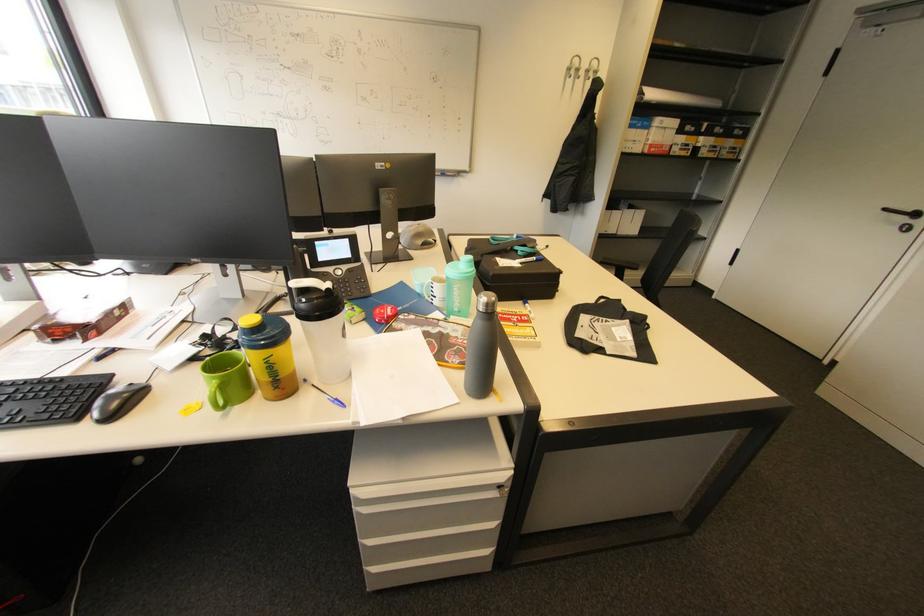
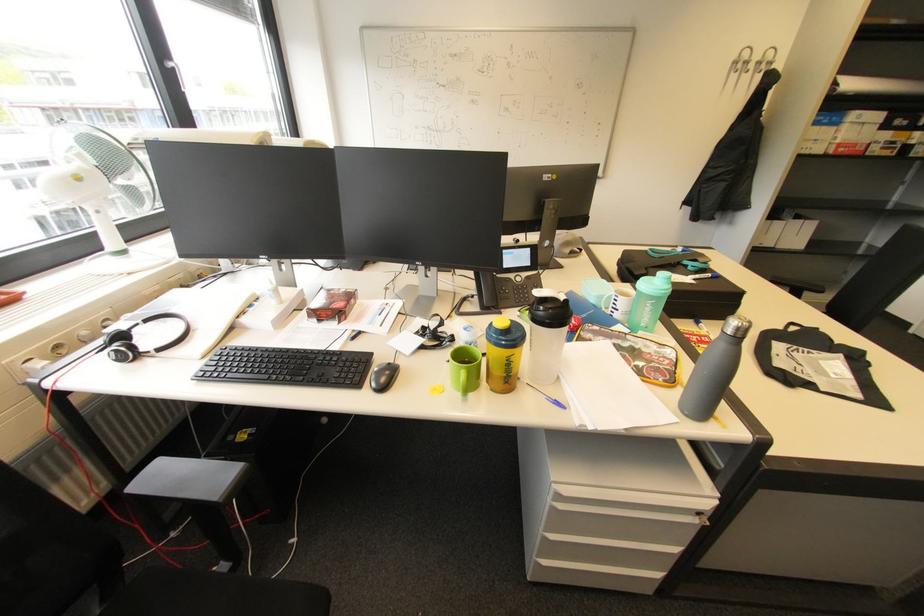
Where in the second image is the point corresponding to (x=117, y=418) from the first image?

(387, 389)